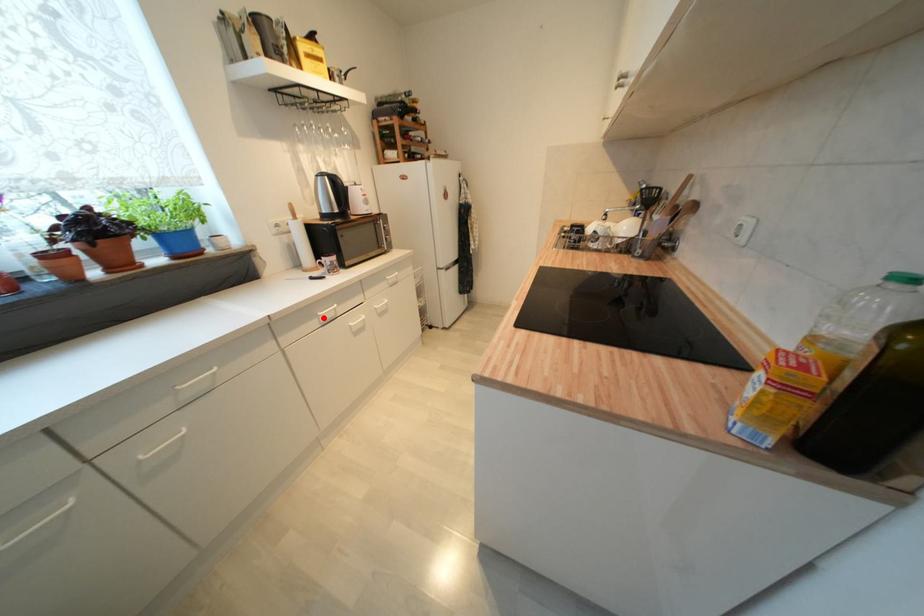
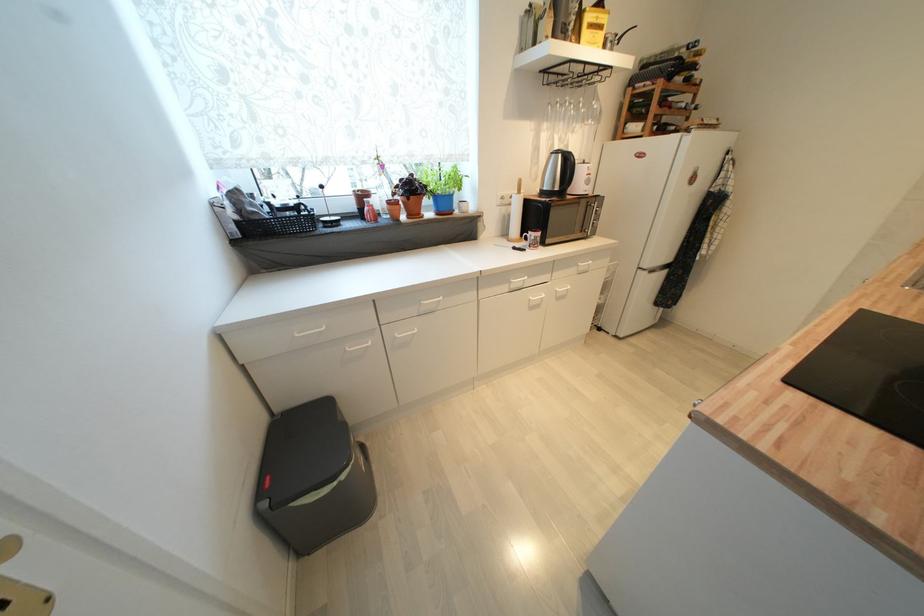
Question: I am providing you with two images of the same scene from different viewpoints. Given a red point in image1, look at the same physical point in image2. Is it:

Choices:
 (A) Closer to the viewpoint
 (B) Farther from the viewpoint

Answer: (B)